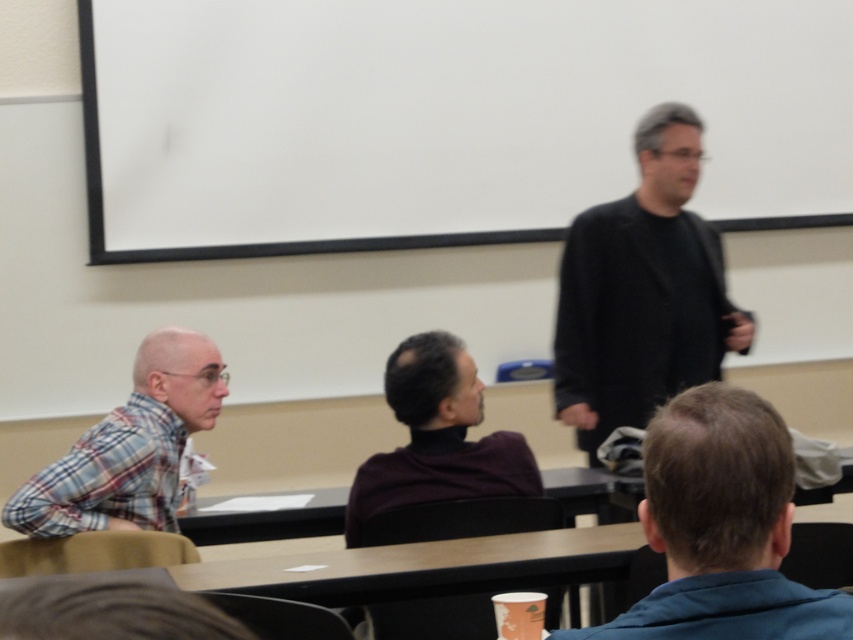
Question: Can you confirm if dark blue fabric at lower right is positioned above plaid fabric shirt at left?

Choices:
 (A) yes
 (B) no

Answer: (A)

Question: Can you confirm if dark purple turtleneck sweater at center is positioned above plaid fabric shirt at left?

Choices:
 (A) no
 (B) yes

Answer: (A)

Question: Which object is positioned farthest from the black matte jacket at upper right?

Choices:
 (A) dark blue fabric at lower right
 (B) dark purple turtleneck sweater at center

Answer: (A)

Question: Is dark purple turtleneck sweater at center thinner than plaid fabric shirt at left?

Choices:
 (A) no
 (B) yes

Answer: (A)

Question: Which point is closer to the camera?

Choices:
 (A) (416, 502)
 (B) (633, 209)
 (C) (647, 541)

Answer: (C)

Question: Which of these objects is positioned farthest from the dark purple turtleneck sweater at center?

Choices:
 (A) black matte jacket at upper right
 (B) dark blue fabric at lower right

Answer: (B)